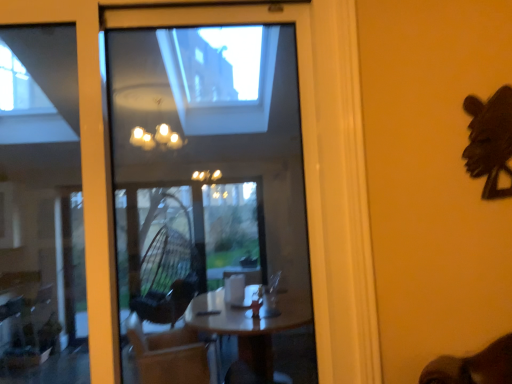
Locate an element on the screen. The image size is (512, 384). black matte mask at upper right is located at coordinates (490, 140).

The image size is (512, 384). What do you see at coordinates (490, 140) in the screenshot?
I see `black matte mask at upper right` at bounding box center [490, 140].

The width and height of the screenshot is (512, 384). Describe the element at coordinates (92, 161) in the screenshot. I see `transparent glass window at center` at that location.

Measure the distance between point (86, 77) and camera.

5.60 feet.

Locate an element on the screen. This screenshot has height=384, width=512. transparent glass window at center is located at coordinates (92, 161).

Measure the distance between transparent glass window at center and camera.

transparent glass window at center and camera are 1.54 meters apart.

At what (x,y) coordinates should I click in order to perform the action: click on black matte mask at upper right. Please return your answer as a coordinate pair (x, y). Looking at the image, I should click on (490, 140).

Considering the positions of objects transparent glass window at center and black matte mask at upper right in the image provided, who is more to the left, transparent glass window at center or black matte mask at upper right?

Positioned to the left is transparent glass window at center.

Is transparent glass window at center in front of black matte mask at upper right?

That is True.

Is point (96, 224) closer or farther from the camera than point (503, 106)?

Point (96, 224) is closer to the camera than point (503, 106).

From the image's perspective, between transparent glass window at center and black matte mask at upper right, which one is located above?

From the image's view, black matte mask at upper right is above.

From a real-world perspective, is transparent glass window at center physically above black matte mask at upper right?

No, from a real-world perspective, transparent glass window at center is not on top of black matte mask at upper right.

Considering the relative sizes of transparent glass window at center and black matte mask at upper right in the image provided, is transparent glass window at center wider than black matte mask at upper right?

Yes.

Which of these two, transparent glass window at center or black matte mask at upper right, stands shorter?

With less height is black matte mask at upper right.

Which of these two, transparent glass window at center or black matte mask at upper right, is bigger?

Bigger between the two is transparent glass window at center.

In the scene shown: Could black matte mask at upper right be considered to be inside transparent glass window at center?

Actually, black matte mask at upper right is outside transparent glass window at center.

Can you see transparent glass window at center touching black matte mask at upper right?

No, transparent glass window at center is not next to black matte mask at upper right.

Is transparent glass window at center oriented away from black matte mask at upper right?

transparent glass window at center is not turned away from black matte mask at upper right.

Consider the image. What's the angular difference between transparent glass window at center and black matte mask at upper right's facing directions?

The angular difference between transparent glass window at center and black matte mask at upper right is 0.0759 degrees.

The height and width of the screenshot is (384, 512). Identify the location of window in front of the black matte mask at upper right. (92, 161).

Considering the positions of objects black matte mask at upper right and transparent glass window at center in the image provided, who is more to the right, black matte mask at upper right or transparent glass window at center?

black matte mask at upper right.

Which object is further away from the camera, black matte mask at upper right or transparent glass window at center?

Positioned behind is black matte mask at upper right.

Does point (469, 140) come behind point (81, 38)?

Yes, it is behind point (81, 38).

From the image's perspective, which is below, black matte mask at upper right or transparent glass window at center?

transparent glass window at center.

From a real-world perspective, which object stands above the other?

In real-world perspective, black matte mask at upper right is above.

Does black matte mask at upper right have a lesser width compared to transparent glass window at center?

Yes, black matte mask at upper right is thinner than transparent glass window at center.

Who is taller, black matte mask at upper right or transparent glass window at center?

transparent glass window at center.

Does black matte mask at upper right have a larger size compared to transparent glass window at center?

No.

Is transparent glass window at center surrounded by black matte mask at upper right?

Definitely not — transparent glass window at center is not inside black matte mask at upper right.

Is black matte mask at upper right beside transparent glass window at center?

No, black matte mask at upper right is not making contact with transparent glass window at center.

Could you tell me if black matte mask at upper right is facing transparent glass window at center?

No, black matte mask at upper right is not turned towards transparent glass window at center.

Where is `window below the black matte mask at upper right (from the image's perspective)`? This screenshot has height=384, width=512. window below the black matte mask at upper right (from the image's perspective) is located at coordinates (92, 161).

At what (x,y) coordinates should I click in order to perform the action: click on window below the black matte mask at upper right (from a real-world perspective). Please return your answer as a coordinate pair (x, y). This screenshot has width=512, height=384. Looking at the image, I should click on (92, 161).

You are a GUI agent. You are given a task and a screenshot of the screen. Output one action in this format:
    pyautogui.click(x=<x>, y=<y>)
    Task: Click on the animal above the transparent glass window at center (from a real-world perspective)
    This screenshot has width=512, height=384.
    Given the screenshot: What is the action you would take?
    pyautogui.click(x=490, y=140)